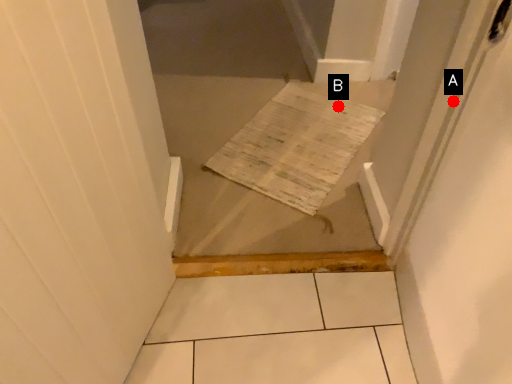
Question: Two points are circled on the image, labeled by A and B beside each circle. Which point is further to the camera?

Choices:
 (A) A is further
 (B) B is further

Answer: (B)